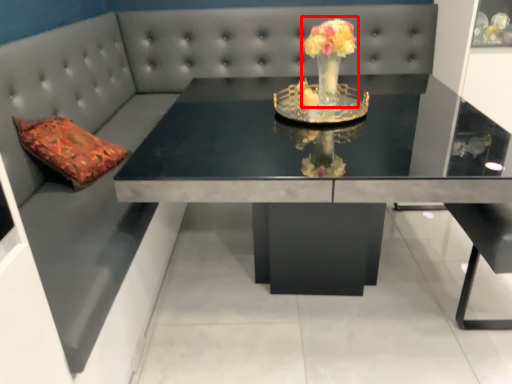
Question: From the image's perspective, where is floral arrangement (annotated by the red box) located in relation to table in the image?

Choices:
 (A) above
 (B) below

Answer: (A)